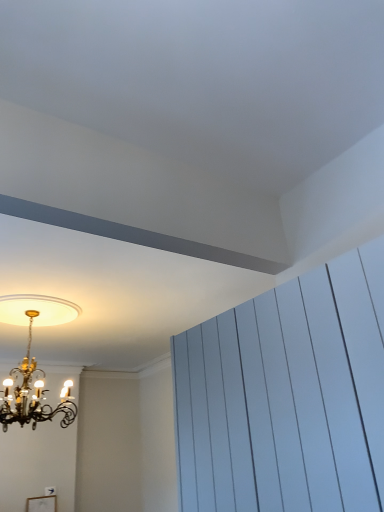
Identify the location of gold metallic chandelier at upper left. (32, 393).

Describe the element at coordinates (32, 393) in the screenshot. I see `gold metallic chandelier at upper left` at that location.

Measure the distance between point (22, 365) and camera.

The distance of point (22, 365) from camera is 9.53 feet.

You are a GUI agent. You are given a task and a screenshot of the screen. Output one action in this format:
    pyautogui.click(x=<x>, y=<y>)
    Task: Click on the gold metallic chandelier at upper left
    This screenshot has height=512, width=384.
    Given the screenshot: What is the action you would take?
    [x=32, y=393]